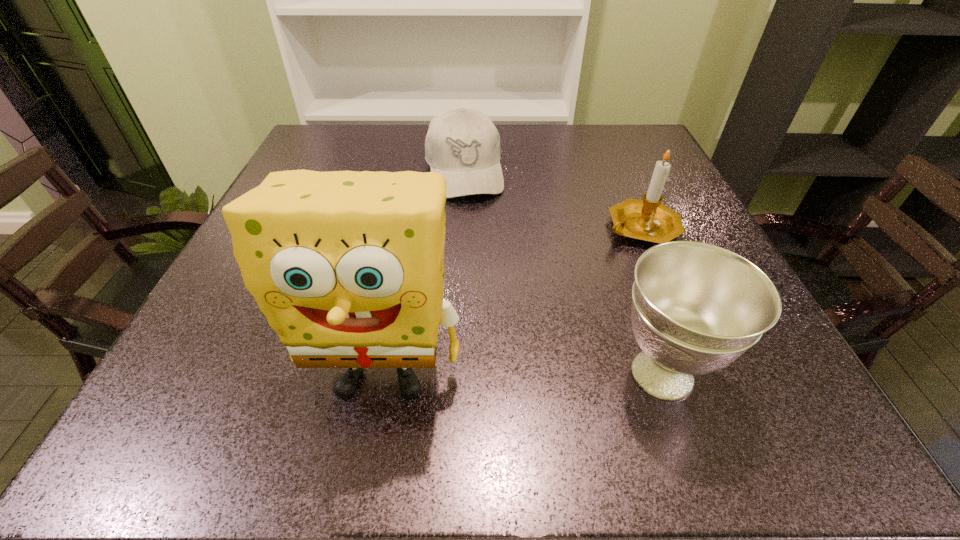
In order to click on free space on the desktop that is between the sponge and the chalice and is positioned with a handle on the candle holder in this screenshot , I will do `click(549, 374)`.

Where is `vacant space on the desktop that is between the sponge and the chalice and is positioned on the front-facing side of the farthest object`? vacant space on the desktop that is between the sponge and the chalice and is positioned on the front-facing side of the farthest object is located at coordinates (508, 374).